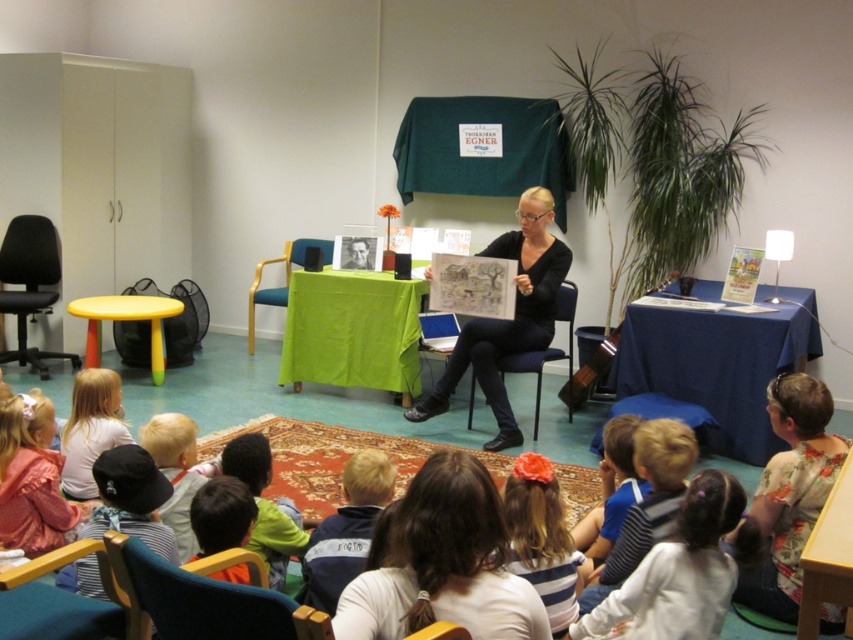
Is point (514, 516) farther from camera compared to point (268, 296)?

No, (514, 516) is in front of (268, 296).

Between striped fabric hairband at center and metallic blue chair at center, which one is positioned lower?

striped fabric hairband at center is below.

Which is behind, point (543, 490) or point (285, 288)?

The point (285, 288) is more distant.

Where is `striped fabric hairband at center`? striped fabric hairband at center is located at coordinates (541, 538).

Is white fabric hairband at lower right to the left of black fabric chair at center from the viewer's perspective?

In fact, white fabric hairband at lower right is to the right of black fabric chair at center.

Does white fabric hairband at lower right have a lesser height compared to black fabric chair at center?

Yes.

Who is more distant from viewer, (706, 561) or (515, 356)?

The point (515, 356) is behind.

This screenshot has height=640, width=853. I want to click on white fabric hairband at lower right, so click(677, 572).

Between point (790, 472) and point (126, 637), which one is positioned behind?

The point (790, 472) is more distant.

Looking at this image, does floral fabric dress at lower right appear under blue fabric chair at lower left?

Actually, floral fabric dress at lower right is above blue fabric chair at lower left.

Which is behind, point (791, 563) or point (193, 596)?

Point (791, 563)

Locate an element on the screen. This screenshot has width=853, height=640. floral fabric dress at lower right is located at coordinates (790, 492).